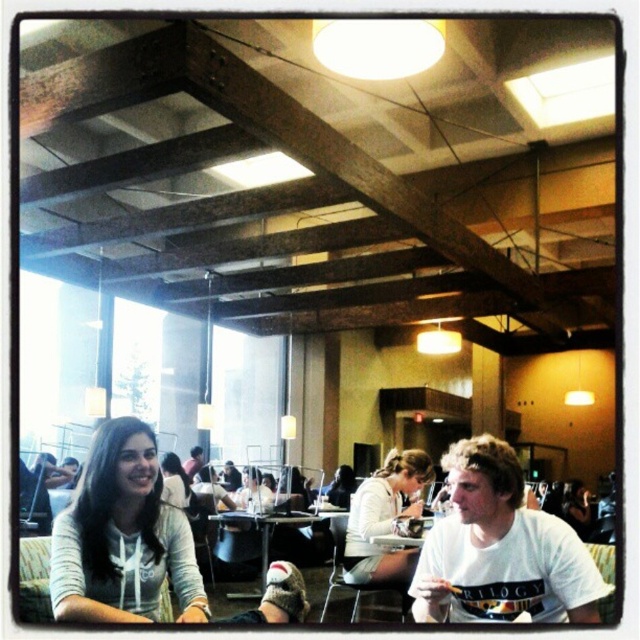
You are trying to place a large coffee mug on the table. The mug is as big as the light gray hoodie at lower left. Will it fit on the wooden table at center?

The light gray hoodie at lower left is smaller than the wooden table at center, so the coffee mug, being the same size as the hoodie, should fit on the table.

You are a barista carrying a tray of drinks and need to place them on the wooden table at center. The white matte jacket at center is currently on the table. Can you slide the jacket to the side to make space?

The white matte jacket at center is thinner than the wooden table at center, so yes, you can slide the jacket to the side to make space on the wooden table at center since it has a smaller width than the table.